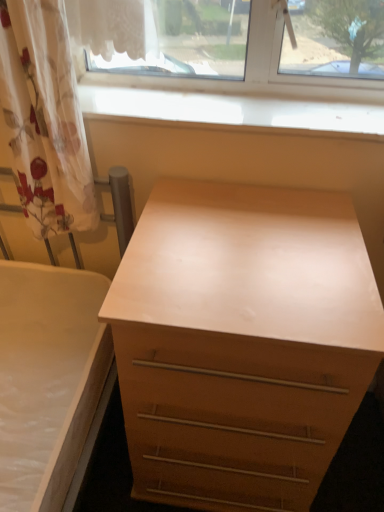
What do you see at coordinates (44, 118) in the screenshot? I see `translucent floral fabric at left` at bounding box center [44, 118].

Describe the element at coordinates (234, 111) in the screenshot. The height and width of the screenshot is (512, 384). I see `smooth wood window sill at upper center` at that location.

Identify the location of light wood chest of drawers at center. The image size is (384, 512). (241, 342).

I want to click on translucent floral fabric at left, so click(x=44, y=118).

Is smooth wood window sill at upper center placed right next to light wood chest of drawers at center?

They are not placed beside each other.

From a real-world perspective, is smooth wood window sill at upper center physically located above or below light wood chest of drawers at center?

smooth wood window sill at upper center is situated higher than light wood chest of drawers at center in the real world.

Is smooth wood window sill at upper center facing away from light wood chest of drawers at center?

No, smooth wood window sill at upper center is not facing the opposite direction of light wood chest of drawers at center.

Is point (267, 114) closer to camera compared to point (325, 245)?

No, (267, 114) is further to viewer.

Which object is wider, translucent floral fabric at left or smooth wood window sill at upper center?

Wider between the two is smooth wood window sill at upper center.

Can you confirm if translucent floral fabric at left is positioned to the left of smooth wood window sill at upper center?

Indeed, translucent floral fabric at left is positioned on the left side of smooth wood window sill at upper center.

Is the depth of translucent floral fabric at left less than that of smooth wood window sill at upper center?

Yes, it is in front of smooth wood window sill at upper center.

Considering the sizes of objects translucent floral fabric at left and smooth wood window sill at upper center in the image provided, who is bigger, translucent floral fabric at left or smooth wood window sill at upper center?

translucent floral fabric at left is bigger.

Between light wood chest of drawers at center and smooth wood window sill at upper center, which one appears on the right side from the viewer's perspective?

light wood chest of drawers at center is more to the right.

Considering the positions of objects light wood chest of drawers at center and smooth wood window sill at upper center in the image provided, who is in front, light wood chest of drawers at center or smooth wood window sill at upper center?

light wood chest of drawers at center is closer to the camera.

Between light wood chest of drawers at center and smooth wood window sill at upper center, which one has smaller size?

With smaller size is smooth wood window sill at upper center.

Would you say light wood chest of drawers at center contains smooth wood window sill at upper center?

That's incorrect, smooth wood window sill at upper center is not inside light wood chest of drawers at center.

Are translucent floral fabric at left and light wood chest of drawers at center making contact?

translucent floral fabric at left and light wood chest of drawers at center are clearly separated.

Is translucent floral fabric at left located outside light wood chest of drawers at center?

Yes, translucent floral fabric at left is not within light wood chest of drawers at center.

Which is in front, point (74, 209) or point (213, 440)?

The point (213, 440) is more forward.

Is light wood chest of drawers at center oriented away from translucent floral fabric at left?

No, light wood chest of drawers at center is not facing away from translucent floral fabric at left.

Measure the distance from light wood chest of drawers at center to translucent floral fabric at left.

The distance of light wood chest of drawers at center from translucent floral fabric at left is 18.86 inches.

From a real-world perspective, who is located higher, light wood chest of drawers at center or translucent floral fabric at left?

In real-world perspective, translucent floral fabric at left is above.

Who is smaller, light wood chest of drawers at center or translucent floral fabric at left?

With smaller size is translucent floral fabric at left.

Is smooth wood window sill at upper center wider or thinner than translucent floral fabric at left?

smooth wood window sill at upper center is wider than translucent floral fabric at left.

Can you confirm if smooth wood window sill at upper center is positioned to the right of translucent floral fabric at left?

Yes.

Which is closer, (179, 106) or (12, 141)?

The point (12, 141) is more forward.

From a real-world perspective, is smooth wood window sill at upper center positioned above or below translucent floral fabric at left?

smooth wood window sill at upper center is below translucent floral fabric at left.

Find the location of a particular element. The height and width of the screenshot is (512, 384). chest of drawers below the smooth wood window sill at upper center (from the image's perspective) is located at coordinates (241, 342).

This screenshot has width=384, height=512. Identify the location of window sill behind the translucent floral fabric at left. (234, 111).

Which object lies further to the anchor point translucent floral fabric at left, smooth wood window sill at upper center or light wood chest of drawers at center?

light wood chest of drawers at center.

Based on the photo, based on their spatial positions, is light wood chest of drawers at center or smooth wood window sill at upper center further from translucent floral fabric at left?

Among the two, light wood chest of drawers at center is located further to translucent floral fabric at left.

Based on the photo, from the image, which object appears to be farther from smooth wood window sill at upper center, translucent floral fabric at left or light wood chest of drawers at center?

Based on the image, light wood chest of drawers at center appears to be further to smooth wood window sill at upper center.

From the image, which object appears to be farther from smooth wood window sill at upper center, light wood chest of drawers at center or translucent floral fabric at left?

light wood chest of drawers at center.

Based on their spatial positions, is translucent floral fabric at left or smooth wood window sill at upper center further from light wood chest of drawers at center?

smooth wood window sill at upper center.

Based on their spatial positions, is smooth wood window sill at upper center or translucent floral fabric at left closer to light wood chest of drawers at center?

Based on the image, translucent floral fabric at left appears to be nearer to light wood chest of drawers at center.

At what (x,y) coordinates should I click in order to perform the action: click on curtain between smooth wood window sill at upper center and light wood chest of drawers at center in the up-down direction. Please return your answer as a coordinate pair (x, y). The height and width of the screenshot is (512, 384). Looking at the image, I should click on (44, 118).